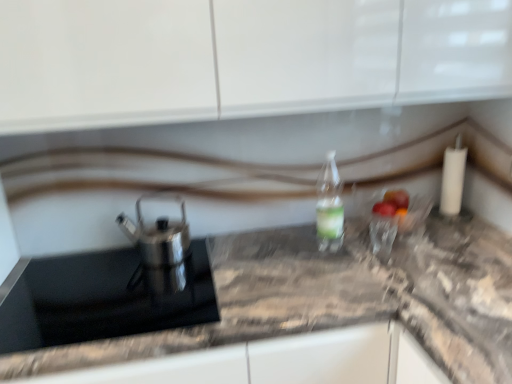
You are a GUI agent. You are given a task and a screenshot of the screen. Output one action in this format:
    pyautogui.click(x=<x>, y=<y>)
    Task: Click on the vacant space to the right of clear plastic bottle at center
    The width and height of the screenshot is (512, 384).
    Given the screenshot: What is the action you would take?
    pyautogui.click(x=373, y=253)